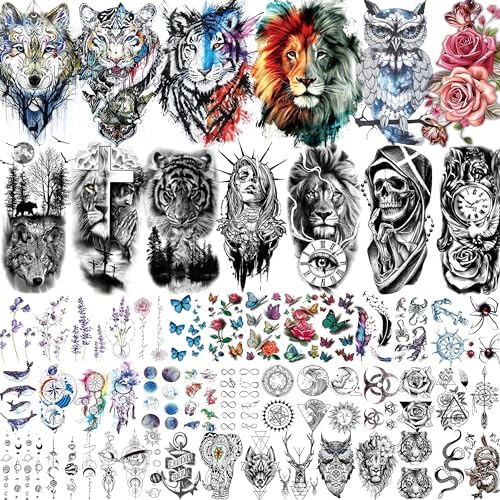
Locate an element on the screen. clock is located at coordinates (341, 257).